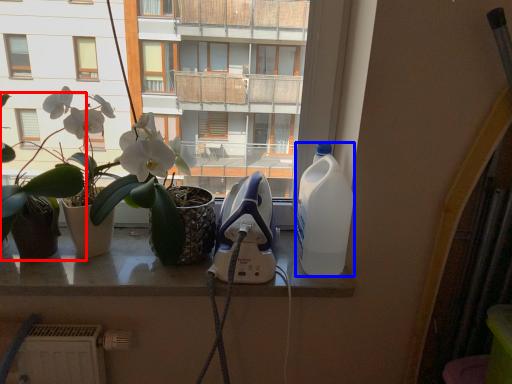
Question: Which object appears farthest to the camera in this image, houseplant (highlighted by a red box) or bottle (highlighted by a blue box)?

Choices:
 (A) houseplant
 (B) bottle

Answer: (B)